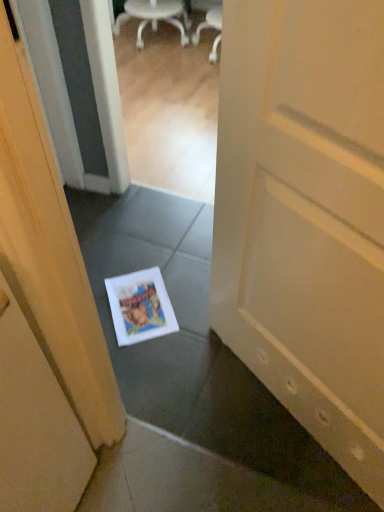
This screenshot has height=512, width=384. What do you see at coordinates (140, 306) in the screenshot?
I see `white matte magazine at center` at bounding box center [140, 306].

What is the approximate width of white matte door at center?

The width of white matte door at center is 3.18 inches.

You are a GUI agent. You are given a task and a screenshot of the screen. Output one action in this format:
    pyautogui.click(x=<x>, y=<y>)
    Task: Click on the white plastic chair at upper center
    The width and height of the screenshot is (384, 512).
    Given the screenshot: What is the action you would take?
    pyautogui.click(x=154, y=17)

From the image's perspective, is white matte door at center above white plastic chair at upper center?

Incorrect, from the image's perspective, white matte door at center is lower than white plastic chair at upper center.

Considering the positions of objects white matte door at center and white plastic chair at upper center in the image provided, who is more to the right, white matte door at center or white plastic chair at upper center?

white matte door at center.

Is white matte door at center taller than white plastic chair at upper center?

Yes.

Looking at their sizes, would you say white matte door at center is wider or thinner than white plastic chair at upper center?

In the image, white matte door at center appears to be more narrow than white plastic chair at upper center.

From the image's perspective, is white matte magazine at center above or below white plastic chair at upper center?

white matte magazine at center is below white plastic chair at upper center.

Considering the relative positions of white matte magazine at center and white plastic chair at upper center in the image provided, is white matte magazine at center in front of white plastic chair at upper center?

Yes, it is.

Does white matte magazine at center have a greater width compared to white plastic chair at upper center?

Incorrect, the width of white matte magazine at center does not surpass that of white plastic chair at upper center.

From a real-world perspective, which is physically above, white plastic chair at upper center or white matte magazine at center?

white plastic chair at upper center, from a real-world perspective.

Which is in front, point (154, 23) or point (145, 309)?

Point (145, 309)

How different are the orientations of white plastic chair at upper center and white matte magazine at center in degrees?

white plastic chair at upper center and white matte magazine at center are facing 142 degrees away from each other.

Is white plastic chair at upper center not inside white matte magazine at center?

Yes, white plastic chair at upper center is outside of white matte magazine at center.

I want to click on door located above the white matte magazine at center (from the image's perspective), so click(306, 216).

Does white matte magazine at center turn towards white matte door at center?

No, white matte magazine at center is not oriented towards white matte door at center.

Considering the relative sizes of white matte magazine at center and white matte door at center in the image provided, is white matte magazine at center thinner than white matte door at center?

In fact, white matte magazine at center might be wider than white matte door at center.

Between point (166, 314) and point (322, 3), which one is positioned behind?

The point (166, 314) is farther from the camera.

Is white matte door at center bigger than white matte magazine at center?

Yes.

Considering the relative positions of white matte door at center and white matte magazine at center in the image provided, is white matte door at center to the left or to the right of white matte magazine at center?

Based on their positions, white matte door at center is located to the right of white matte magazine at center.

Based on the photo, from the image's perspective, is white matte door at center beneath white matte magazine at center?

No, from the image's perspective, white matte door at center is not beneath white matte magazine at center.

Which of these two, white matte door at center or white matte magazine at center, stands shorter?

white matte magazine at center.

Are white plastic chair at upper center and white matte door at center making contact?

white plastic chair at upper center and white matte door at center are not in contact.

Which is more to the right, white plastic chair at upper center or white matte door at center?

From the viewer's perspective, white matte door at center appears more on the right side.

From the image's perspective, between white plastic chair at upper center and white matte door at center, which one is located above?

white plastic chair at upper center.

The image size is (384, 512). What are the coordinates of `chair on the left side of white matte door at center` in the screenshot? It's located at (154, 17).

Image resolution: width=384 pixels, height=512 pixels. Find the location of `magazine that appears below the white plastic chair at upper center (from the image's perspective)`. magazine that appears below the white plastic chair at upper center (from the image's perspective) is located at coordinates (140, 306).

Based on their spatial positions, is white plastic chair at upper center or white matte magazine at center further from white matte door at center?

white plastic chair at upper center.

Considering their positions, is white matte door at center positioned further to white plastic chair at upper center than white matte magazine at center?

white matte door at center.

Based on their spatial positions, is white matte magazine at center or white plastic chair at upper center further from white matte door at center?

white plastic chair at upper center is further to white matte door at center.

Estimate the real-world distances between objects in this image. Which object is closer to white matte magazine at center, white plastic chair at upper center or white matte door at center?

white matte door at center.

Looking at the image, which one is located closer to white matte magazine at center, white matte door at center or white plastic chair at upper center?

A: Among the two, white matte door at center is located nearer to white matte magazine at center.

Looking at the image, which one is located further to white plastic chair at upper center, white matte magazine at center or white matte door at center?

white matte door at center lies further to white plastic chair at upper center than the other object.

This screenshot has width=384, height=512. In order to click on magazine between white matte door at center and white plastic chair at upper center from front to back in this screenshot , I will do `click(140, 306)`.